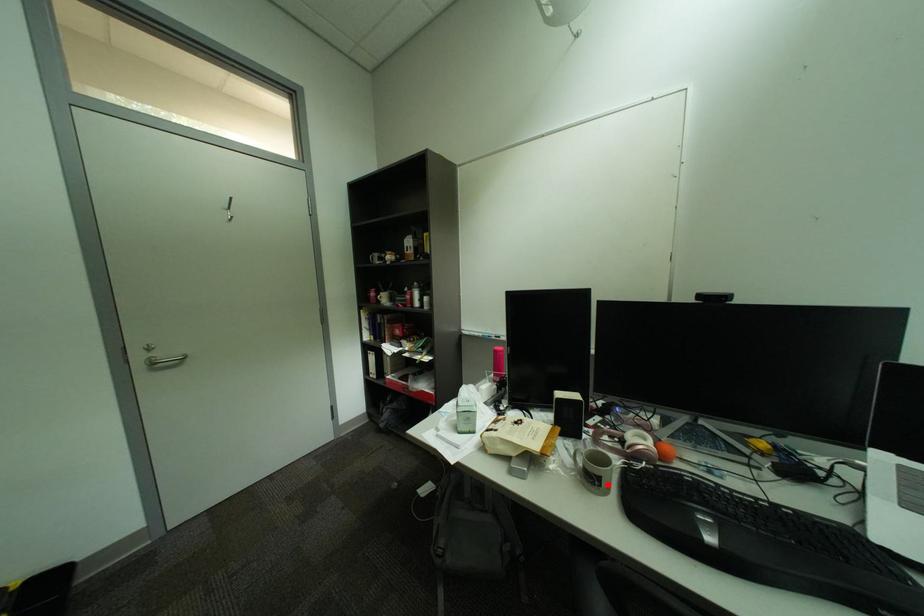
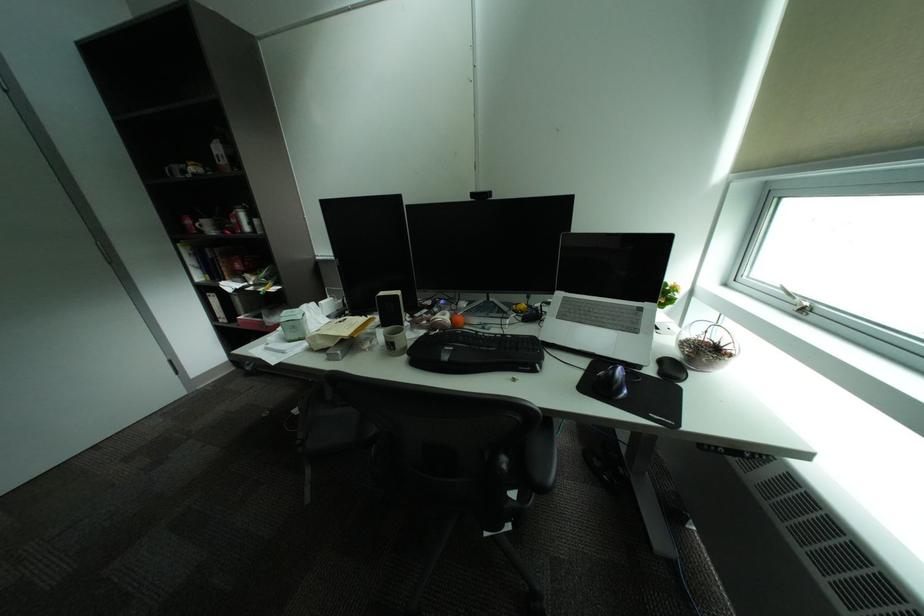
Locate, in the second image, the point that corresponds to the highlighted location in the first image.

(403, 349)